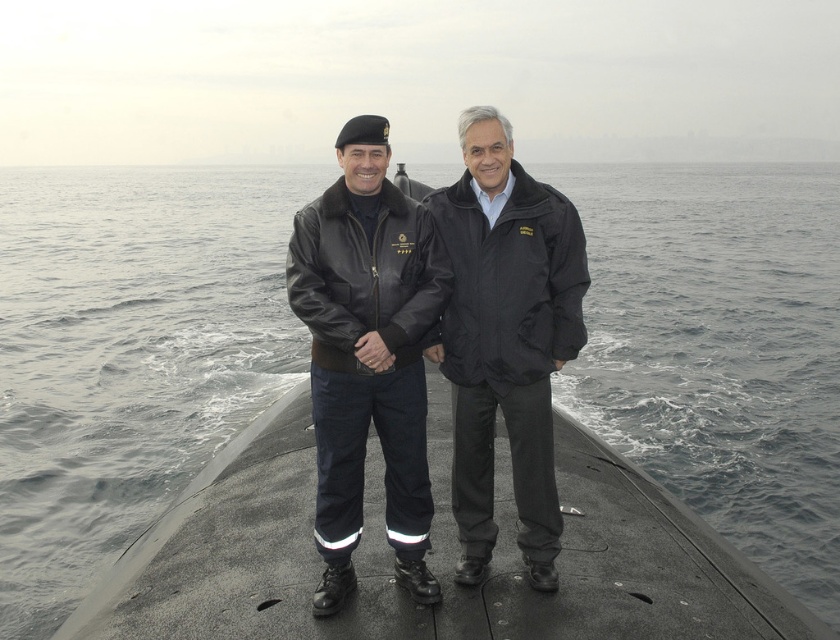
Is gray water at center thinner than matte black jacket at center?

Incorrect, gray water at center's width is not less than matte black jacket at center's.

Between gray water at center and matte black jacket at center, which one is positioned lower?

matte black jacket at center

At what (x,y) coordinates should I click in order to perform the action: click on gray water at center. Please return your answer as a coordinate pair (x, y). This screenshot has height=640, width=840. Looking at the image, I should click on coord(129,353).

Where is `gray water at center`? gray water at center is located at coordinates (129, 353).